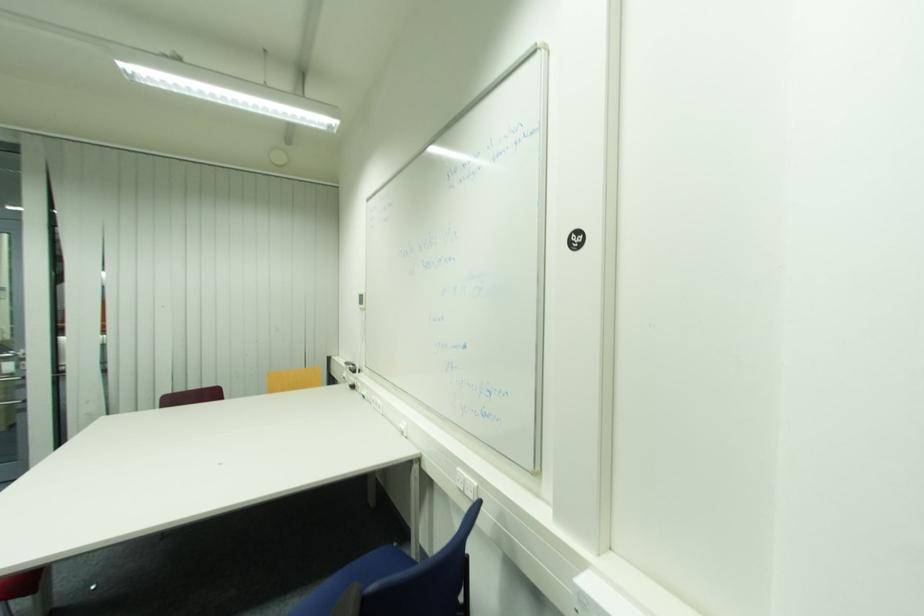
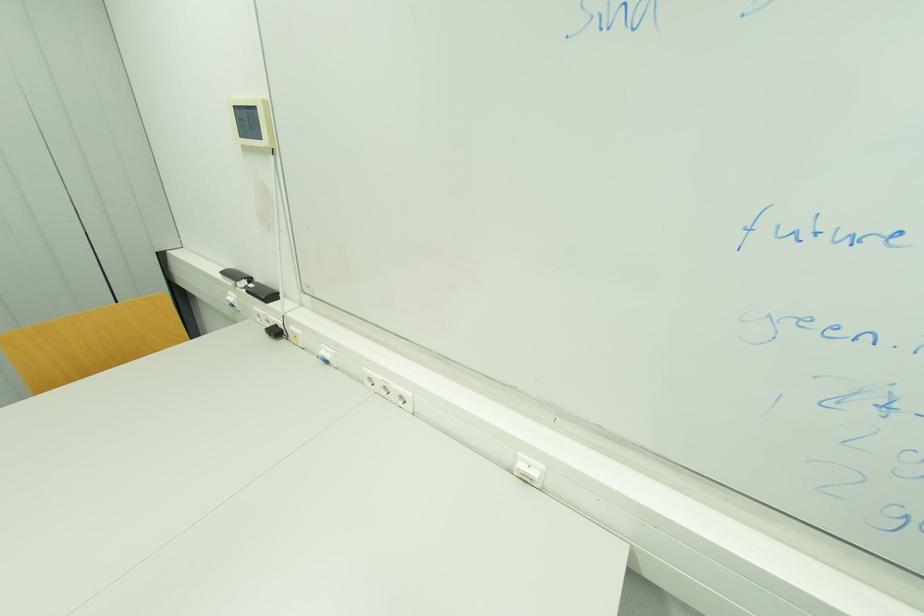
Find the pixel in the second image that matches the point at 368,398 in the first image.

(330, 362)